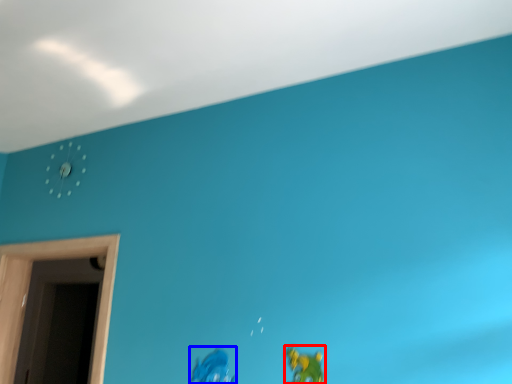
Question: Which object is further to the camera taking this photo, toy (highlighted by a red box) or toy (highlighted by a blue box)?

Choices:
 (A) toy
 (B) toy

Answer: (B)